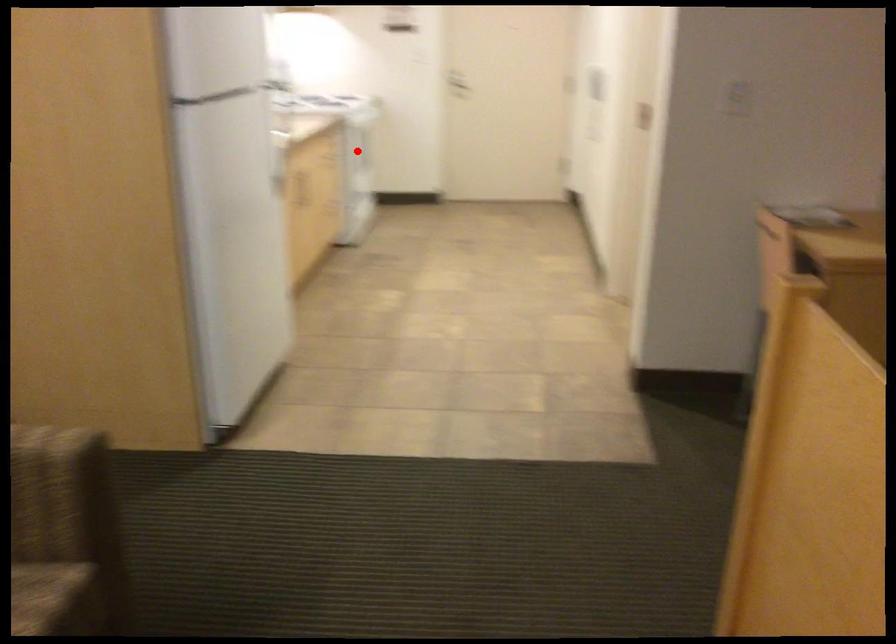
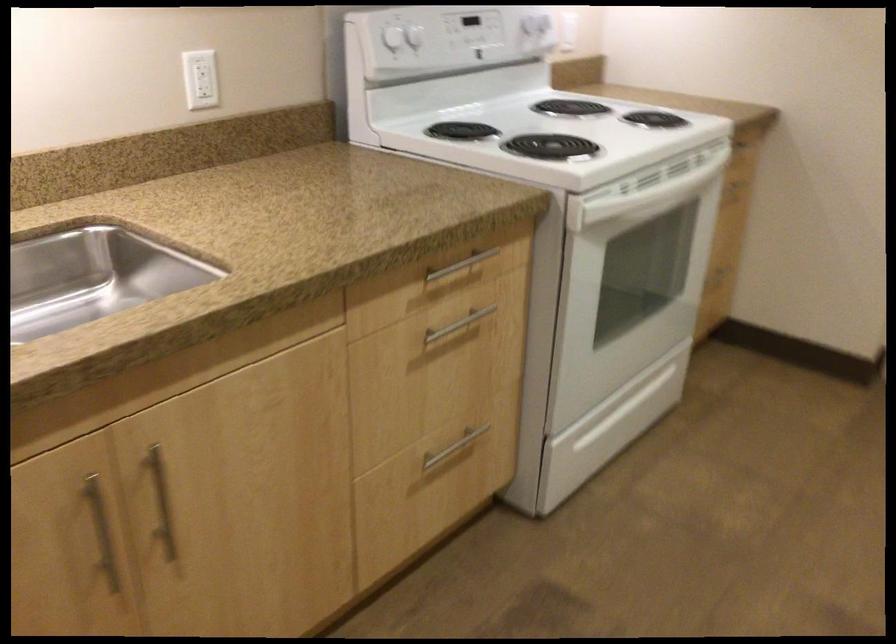
Question: I am providing you with two images of the same scene from different viewpoints. Given a red point in image1, look at the same physical point in image2. Is it:

Choices:
 (A) Closer to the viewpoint
 (B) Farther from the viewpoint

Answer: (A)